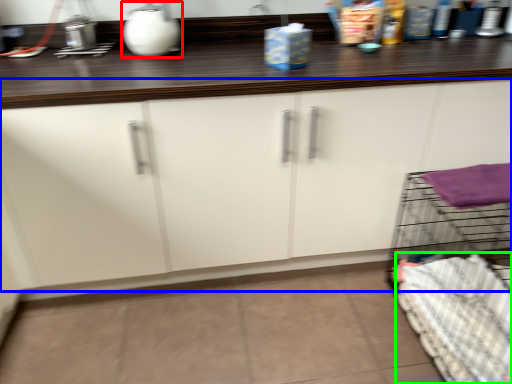
Question: Which is nearer to the appliance (highlighted by a red box)? cabinetry (highlighted by a blue box) or bedding (highlighted by a green box).

Choices:
 (A) cabinetry
 (B) bedding

Answer: (A)